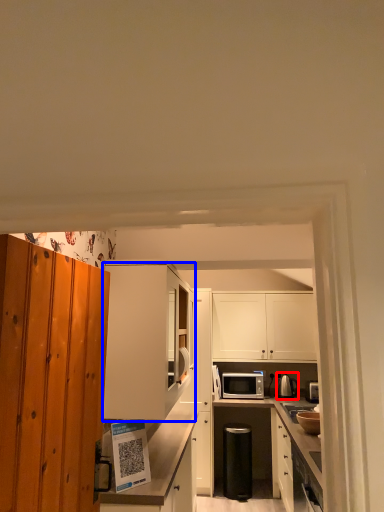
Question: Which object appears farthest to the camera in this image, appliance (highlighted by a red box) or cabinetry (highlighted by a blue box)?

Choices:
 (A) appliance
 (B) cabinetry

Answer: (A)